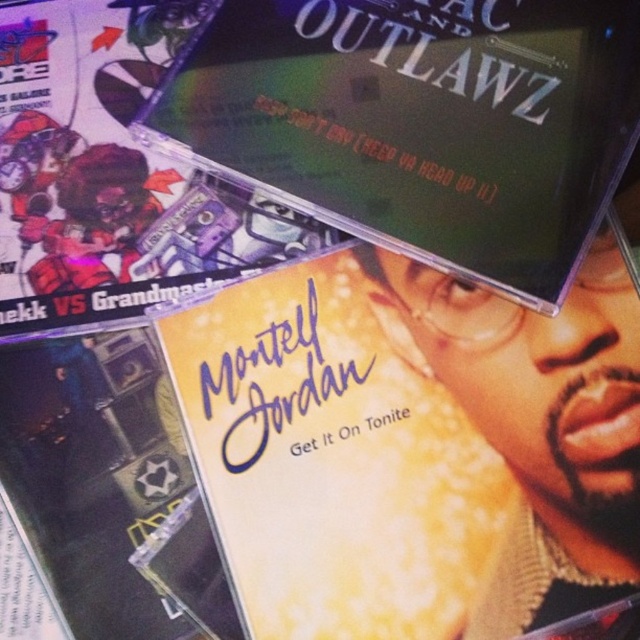
Can you confirm if matte plastic cd at upper center is bigger than matte black cd at upper left?

Yes.

Does matte plastic cd at upper center have a lesser height compared to matte black cd at upper left?

Indeed, matte plastic cd at upper center has a lesser height compared to matte black cd at upper left.

Does point (228, 8) lie in front of point (74, 17)?

That is True.

I want to click on matte plastic cd at upper center, so click(419, 122).